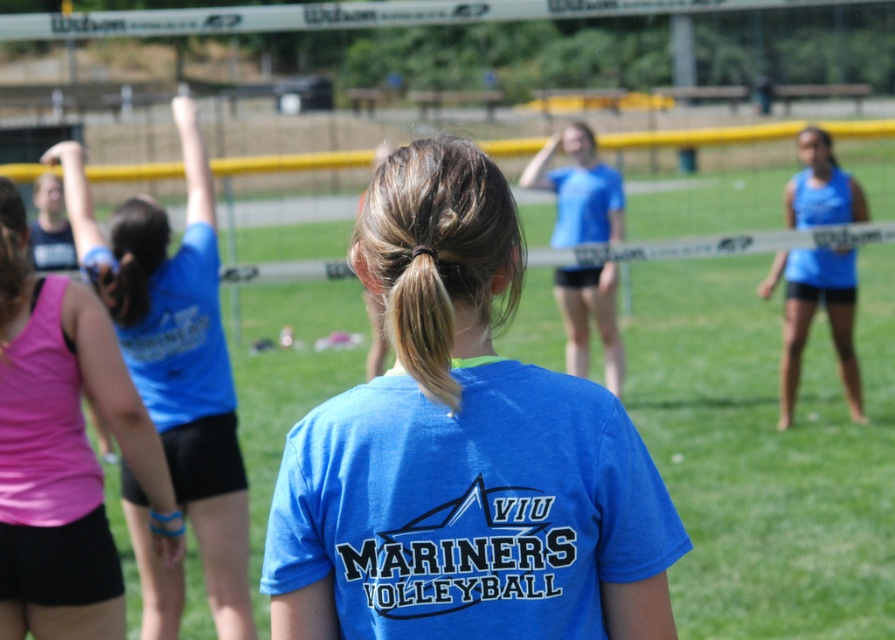
You are a photographer trying to capture the action during a volleyball match. You notice two players wearing pink fabric shorts at left and blue matte shorts at right. Which player should you focus on if you want to photograph someone who is closer to the camera?

The pink fabric shorts at left has a lesser height compared to blue matte shorts at right, so the player wearing pink fabric shorts at left is closer to the camera.

You are a referee observing a volleyball match. You need to ensure that all players are positioned within the court boundaries. The court is 60 feet long. Can you confirm whether the distance between the pink fabric shorts at left and blue matte shorts at right is within the court length?

The distance between the pink fabric shorts at left and blue matte shorts at right is 27.14 feet, which is less than the court length of 60 feet. Therefore, the players are positioned within the court boundaries.